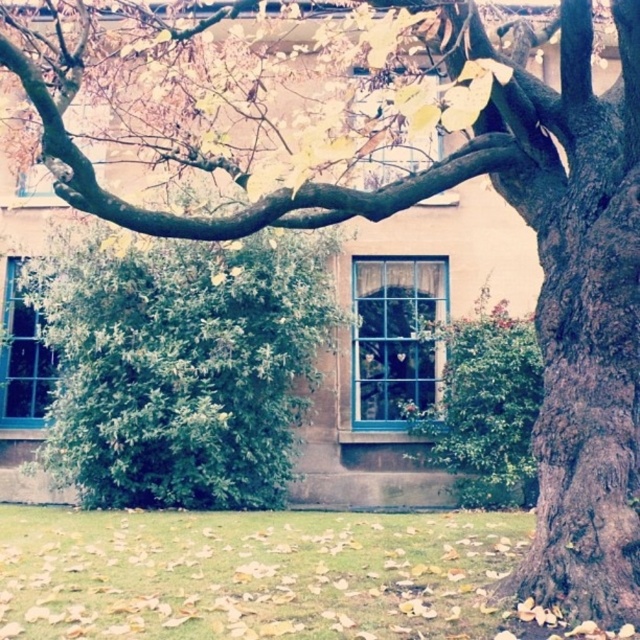
Can you confirm if green grass at lower center is positioned below blue glass window at center left?

Indeed, green grass at lower center is positioned under blue glass window at center left.

Who is shorter, green grass at lower center or blue glass window at center left?

green grass at lower center

Describe the element at coordinates (250, 573) in the screenshot. I see `green grass at lower center` at that location.

Where is `green grass at lower center`? green grass at lower center is located at coordinates (250, 573).

Who is taller, blue glass window at center or blue glass window at center left?

blue glass window at center left is taller.

Is blue glass window at center behind blue glass window at center left?

That is False.

Between point (406, 396) and point (17, 285), which one is positioned in front?

Positioned in front is point (406, 396).

Where is `blue glass window at center`? The height and width of the screenshot is (640, 640). blue glass window at center is located at coordinates (396, 333).

Who is more forward, (76,589) or (417,352)?

Point (76,589) is more forward.

Is green grass at lower center smaller than blue glass window at center?

No.

Who is more forward, (x=316, y=529) or (x=394, y=285)?

Point (x=316, y=529) is more forward.

Identify the location of green grass at lower center. coord(250,573).